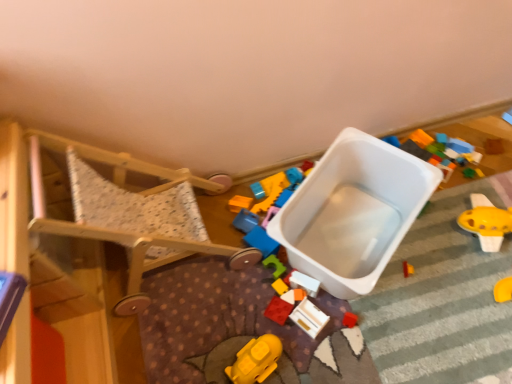
The image size is (512, 384). Identify the location of free space behind yellow plastic toy at right, which is counted as the first toy, starting from the right. (472, 193).